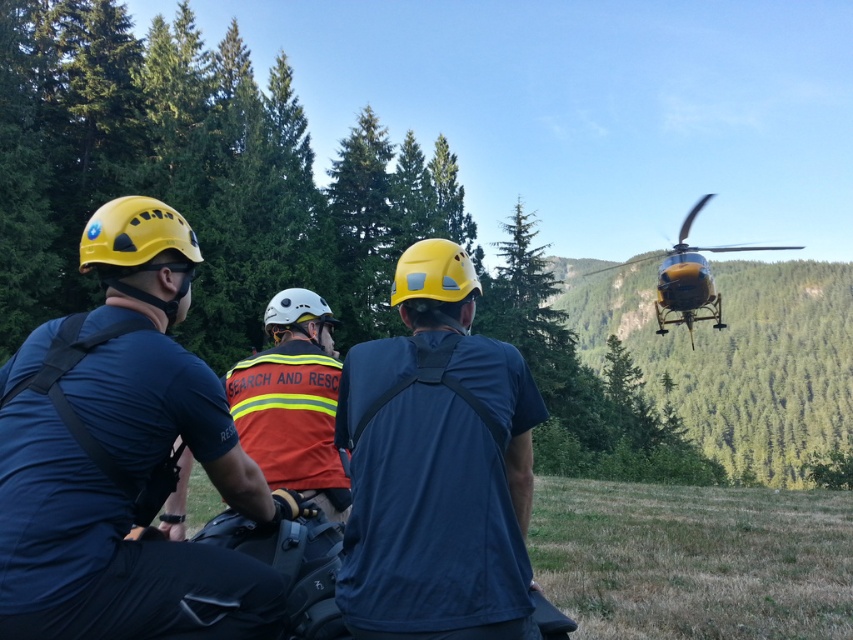
Measure the distance between point (277, 513) and camera.

A distance of 3.23 meters exists between point (277, 513) and camera.

Who is positioned more to the right, matte yellow helmet at left or orange reflective safety vest at center?

orange reflective safety vest at center

Describe the element at coordinates (123, 458) in the screenshot. This screenshot has width=853, height=640. I see `matte yellow helmet at left` at that location.

Where is `matte yellow helmet at left`? This screenshot has width=853, height=640. matte yellow helmet at left is located at coordinates (123, 458).

Based on the photo, is matte yellow helmet at left thinner than yellow metallic helicopter at upper right?

Yes, matte yellow helmet at left is thinner than yellow metallic helicopter at upper right.

Looking at this image, between matte yellow helmet at left and yellow metallic helicopter at upper right, which one appears on the left side from the viewer's perspective?

matte yellow helmet at left is more to the left.

Locate an element on the screen. matte yellow helmet at left is located at coordinates (123, 458).

Consider the image. Which is above, matte yellow helmet at center or yellow metallic helicopter at upper right?

yellow metallic helicopter at upper right is higher up.

Is matte yellow helmet at center below yellow metallic helicopter at upper right?

Indeed, matte yellow helmet at center is positioned under yellow metallic helicopter at upper right.

Does point (346, 397) lie in front of point (711, 285)?

That is True.

This screenshot has height=640, width=853. Identify the location of matte yellow helmet at center. (437, 467).